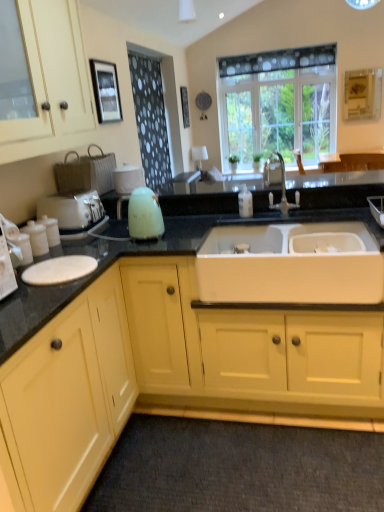
Describe the element at coordinates (278, 103) in the screenshot. I see `transparent polka dot curtain at upper center` at that location.

Where is `transparent polka dot curtain at upper center`? The width and height of the screenshot is (384, 512). transparent polka dot curtain at upper center is located at coordinates (278, 103).

What is the approximate width of white plastic toaster at left?

white plastic toaster at left is 13.80 inches wide.

Find the location of `yellow matte cabinet at left, which is the second cabinetry in top-to-bottom order`. yellow matte cabinet at left, which is the second cabinetry in top-to-bottom order is located at coordinates (69, 397).

What is the approximate width of matte cream cabinet at upper left, the first cabinetry in the top-to-bottom sequence?

matte cream cabinet at upper left, the first cabinetry in the top-to-bottom sequence, is 16.39 inches in width.

In order to face matte cream cabinet at upper left, the first cabinetry in the top-to-bottom sequence, should I rotate leftwards or rightwards?

Turn left by 23.027 degrees to look at matte cream cabinet at upper left, the first cabinetry in the top-to-bottom sequence.

Measure the distance between point (111, 121) and camera.

10.50 feet.

I want to click on white matte sink at center, so click(x=291, y=264).

From the image's perspective, which is above, matte cream cabinet at upper left, the first cabinetry in the top-to-bottom sequence, or white matte sink at center?

matte cream cabinet at upper left, the first cabinetry in the top-to-bottom sequence, appears higher in the image.

Find the location of a particular element. This screenshot has height=512, width=384. sink that appears below the matte cream cabinet at upper left, the first cabinetry in the top-to-bottom sequence (from a real-world perspective) is located at coordinates (291, 264).

Is matte cream cabinet at upper left, the first cabinetry in the top-to-bottom sequence, situated inside white matte sink at center or outside?

matte cream cabinet at upper left, the first cabinetry in the top-to-bottom sequence, is located beyond the bounds of white matte sink at center.

From a real-world perspective, does matte cream cabinet at upper left, which is the 2th cabinetry from bottom to top, stand above white matte sink at center?

Yes, from a real-world perspective, matte cream cabinet at upper left, which is the 2th cabinetry from bottom to top, is on top of white matte sink at center.

Between white plastic toaster at left and yellow matte cabinet at left, the first cabinetry in the bottom-to-top sequence, which one has larger width?

yellow matte cabinet at left, the first cabinetry in the bottom-to-top sequence, is wider.

Who is shorter, white plastic toaster at left or yellow matte cabinet at left, the first cabinetry in the bottom-to-top sequence?

white plastic toaster at left.

From a real-world perspective, who is located lower, white plastic toaster at left or yellow matte cabinet at left, the first cabinetry in the bottom-to-top sequence?

yellow matte cabinet at left, the first cabinetry in the bottom-to-top sequence, from a real-world perspective.

From the image's perspective, is white plastic toaster at left under yellow matte cabinet at left, the first cabinetry in the bottom-to-top sequence?

No, from the image's perspective, white plastic toaster at left is not below yellow matte cabinet at left, the first cabinetry in the bottom-to-top sequence.

The image size is (384, 512). In the image, there is a white matte sink at center. Identify the location of appliance above it (from the image's perspective). [72, 210].

From the picture: Does white plastic toaster at left have a smaller size compared to white matte sink at center?

Correct, white plastic toaster at left occupies less space than white matte sink at center.

Considering the positions of objects white plastic toaster at left and white matte sink at center in the image provided, who is behind, white plastic toaster at left or white matte sink at center?

white plastic toaster at left is behind.

Is white plastic toaster at left looking in the opposite direction of white matte sink at center?

That's not correct — white plastic toaster at left is not looking away from white matte sink at center.

Does matte cream cabinet at upper left, the first cabinetry in the top-to-bottom sequence, have a larger size compared to white plastic toaster at left?

Indeed, matte cream cabinet at upper left, the first cabinetry in the top-to-bottom sequence, has a larger size compared to white plastic toaster at left.

Which object is more forward, matte cream cabinet at upper left, which is the 2th cabinetry from bottom to top, or white plastic toaster at left?

matte cream cabinet at upper left, which is the 2th cabinetry from bottom to top.

Is matte cream cabinet at upper left, which is the 2th cabinetry from bottom to top, not within white plastic toaster at left?

Yes, matte cream cabinet at upper left, which is the 2th cabinetry from bottom to top, is outside of white plastic toaster at left.

How many degrees apart are the facing directions of matte cream cabinet at upper left, which is the 2th cabinetry from bottom to top, and white plastic toaster at left?

They differ by 0.985 degrees in their facing directions.

Is yellow matte cabinet at left, which is the second cabinetry in top-to-bottom order, oriented towards transparent polka dot curtain at upper center?

No, yellow matte cabinet at left, which is the second cabinetry in top-to-bottom order, does not turn towards transparent polka dot curtain at upper center.

Is yellow matte cabinet at left, which is the second cabinetry in top-to-bottom order, positioned behind transparent polka dot curtain at upper center?

No, yellow matte cabinet at left, which is the second cabinetry in top-to-bottom order, is closer to the viewer.

From the image's perspective, is yellow matte cabinet at left, the first cabinetry in the bottom-to-top sequence, located above or below transparent polka dot curtain at upper center?

yellow matte cabinet at left, the first cabinetry in the bottom-to-top sequence, is below transparent polka dot curtain at upper center.

In terms of size, does yellow matte cabinet at left, which is the second cabinetry in top-to-bottom order, appear bigger or smaller than transparent polka dot curtain at upper center?

Considering their sizes, yellow matte cabinet at left, which is the second cabinetry in top-to-bottom order, takes up more space than transparent polka dot curtain at upper center.

From a real-world perspective, relative to white plastic toaster at left, is dark gray carpet at lower center vertically above or below?

dark gray carpet at lower center is below white plastic toaster at left.

From the image's perspective, is dark gray carpet at lower center above or below white plastic toaster at left?

Based on their image positions, dark gray carpet at lower center is located beneath white plastic toaster at left.

Looking at this image, is dark gray carpet at lower center facing towards white plastic toaster at left?

No, dark gray carpet at lower center is not facing towards white plastic toaster at left.

Does point (347, 444) lie in front of point (53, 202)?

That is True.

From a real-world perspective, which is physically below, dark gray carpet at lower center or matte cream cabinet at upper left, which is the 2th cabinetry from bottom to top?

dark gray carpet at lower center.

Is dark gray carpet at lower center inside the boundaries of matte cream cabinet at upper left, the first cabinetry in the top-to-bottom sequence, or outside?

dark gray carpet at lower center lies outside matte cream cabinet at upper left, the first cabinetry in the top-to-bottom sequence.

Which object is closer to the camera, dark gray carpet at lower center or matte cream cabinet at upper left, which is the 2th cabinetry from bottom to top?

matte cream cabinet at upper left, which is the 2th cabinetry from bottom to top, is more forward.

From the image's perspective, between dark gray carpet at lower center and matte cream cabinet at upper left, which is the 2th cabinetry from bottom to top, which one is located above?

matte cream cabinet at upper left, which is the 2th cabinetry from bottom to top.

You are a GUI agent. You are given a task and a screenshot of the screen. Output one action in this format:
    pyautogui.click(x=<x>, y=<y>)
    Task: Click on the cabinetry above the white matte sink at center (from a real-world perspective)
    This screenshot has width=384, height=512.
    Given the screenshot: What is the action you would take?
    pyautogui.click(x=51, y=82)

Identify the location of cabinetry below the white plastic toaster at left (from a real-world perspective). (69, 397).

From the image, which object appears to be farther from white matte sink at center, transparent polka dot curtain at upper center or white plastic toaster at left?

transparent polka dot curtain at upper center is positioned further to the anchor white matte sink at center.

When comparing their distances from black granite countertop at center, does dark gray carpet at lower center or black dotted fabric at upper left seem closer?

dark gray carpet at lower center is positioned closer to the anchor black granite countertop at center.

Estimate the real-world distances between objects in this image. Which object is closer to matte cream cabinet at upper left, which is the 2th cabinetry from bottom to top, silver metallic faucet at upper center or black granite countertop at center?

Based on the image, black granite countertop at center appears to be nearer to matte cream cabinet at upper left, which is the 2th cabinetry from bottom to top.

Estimate the real-world distances between objects in this image. Which object is closer to white matte sink at center, transparent polka dot curtain at upper center or black dotted fabric at upper left?

Among the two, black dotted fabric at upper left is located nearer to white matte sink at center.

From the image, which object appears to be farther from matte cream cabinet at upper left, the first cabinetry in the top-to-bottom sequence, dark gray carpet at lower center or silver metallic faucet at upper center?

The object further to matte cream cabinet at upper left, the first cabinetry in the top-to-bottom sequence, is dark gray carpet at lower center.

Estimate the real-world distances between objects in this image. Which object is closer to yellow matte cabinet at left, which is the second cabinetry in top-to-bottom order, black granite countertop at center or silver metallic faucet at upper center?

black granite countertop at center.

From the image, which object appears to be nearer to white plastic toaster at left, black granite countertop at center or silver metallic faucet at upper center?

black granite countertop at center.

When comparing their distances from silver metallic faucet at upper center, does matte cream cabinet at upper left, the first cabinetry in the top-to-bottom sequence, or white matte sink at center seem further?

matte cream cabinet at upper left, the first cabinetry in the top-to-bottom sequence, lies further to silver metallic faucet at upper center than the other object.

Locate an element on the screen. Image resolution: width=384 pixels, height=512 pixels. countertop between yellow matte cabinet at left, the first cabinetry in the bottom-to-top sequence, and silver metallic faucet at upper center is located at coordinates (133, 255).

You are a GUI agent. You are given a task and a screenshot of the screen. Output one action in this format:
    pyautogui.click(x=<x>, y=<y>)
    Task: Click on the sink between yellow matte cabinet at left, the first cabinetry in the bottom-to-top sequence, and black dotted fabric at upper left in the front-back direction
    This screenshot has width=384, height=512.
    Given the screenshot: What is the action you would take?
    coord(291,264)

Locate an element on the screen. Image resolution: width=384 pixels, height=512 pixels. cabinetry situated between matte cream cabinet at upper left, which is the 2th cabinetry from bottom to top, and white matte sink at center from left to right is located at coordinates (69, 397).

Locate an element on the screen. This screenshot has height=512, width=384. tap between matte cream cabinet at upper left, which is the 2th cabinetry from bottom to top, and dark gray carpet at lower center in the up-down direction is located at coordinates (281, 185).